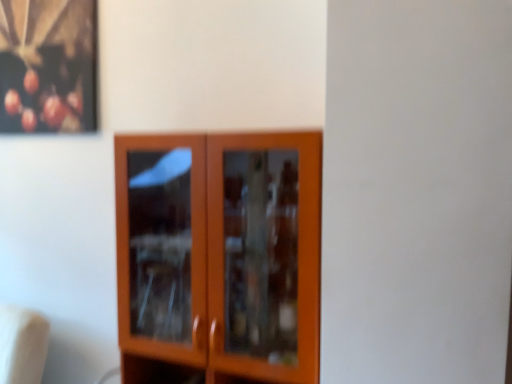
Where is `matte wood cupboard at center`? matte wood cupboard at center is located at coordinates (219, 256).

The image size is (512, 384). What do you see at coordinates (219, 256) in the screenshot? I see `matte wood cupboard at center` at bounding box center [219, 256].

I want to click on matte wood cupboard at center, so click(x=219, y=256).